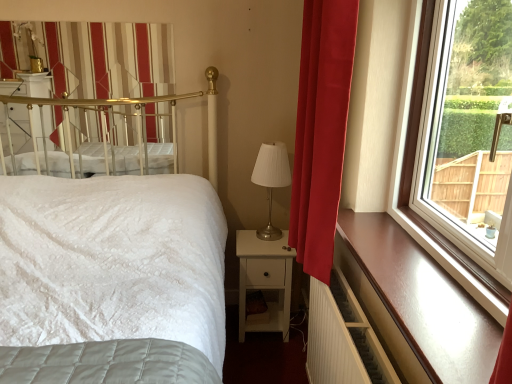
Question: Is the position of metallic silver table lamp at center more distant than that of white matte nightstand at center?

Choices:
 (A) yes
 (B) no

Answer: (B)

Question: Is metallic silver table lamp at center positioned beyond the bounds of white matte nightstand at center?

Choices:
 (A) no
 (B) yes

Answer: (B)

Question: From the image's perspective, would you say metallic silver table lamp at center is positioned over white matte nightstand at center?

Choices:
 (A) no
 (B) yes

Answer: (B)

Question: Can you confirm if metallic silver table lamp at center is positioned to the right of white matte nightstand at center?

Choices:
 (A) no
 (B) yes

Answer: (B)

Question: Is white matte nightstand at center inside metallic silver table lamp at center?

Choices:
 (A) no
 (B) yes

Answer: (A)

Question: From a real-world perspective, is gold metallic canopy bed at upper left positioned above or below metallic silver table lamp at center?

Choices:
 (A) below
 (B) above

Answer: (B)

Question: Looking at their shapes, would you say gold metallic canopy bed at upper left is wider or thinner than metallic silver table lamp at center?

Choices:
 (A) thin
 (B) wide

Answer: (A)

Question: Based on their sizes in the image, would you say gold metallic canopy bed at upper left is bigger or smaller than metallic silver table lamp at center?

Choices:
 (A) big
 (B) small

Answer: (B)

Question: From the image's perspective, is gold metallic canopy bed at upper left positioned above or below metallic silver table lamp at center?

Choices:
 (A) above
 (B) below

Answer: (A)

Question: From a real-world perspective, is white glossy radiator at lower right above or below gold metallic canopy bed at upper left?

Choices:
 (A) above
 (B) below

Answer: (B)

Question: Is white glossy radiator at lower right to the left or to the right of gold metallic canopy bed at upper left in the image?

Choices:
 (A) right
 (B) left

Answer: (A)

Question: Is white glossy radiator at lower right inside the boundaries of gold metallic canopy bed at upper left, or outside?

Choices:
 (A) outside
 (B) inside

Answer: (A)

Question: Is white glossy radiator at lower right wider or thinner than gold metallic canopy bed at upper left?

Choices:
 (A) thin
 (B) wide

Answer: (B)

Question: Is brown polished wood ledge at right spatially inside gold metallic canopy bed at upper left, or outside of it?

Choices:
 (A) outside
 (B) inside

Answer: (A)

Question: Is point (338, 235) closer or farther from the camera than point (96, 134)?

Choices:
 (A) farther
 (B) closer

Answer: (B)